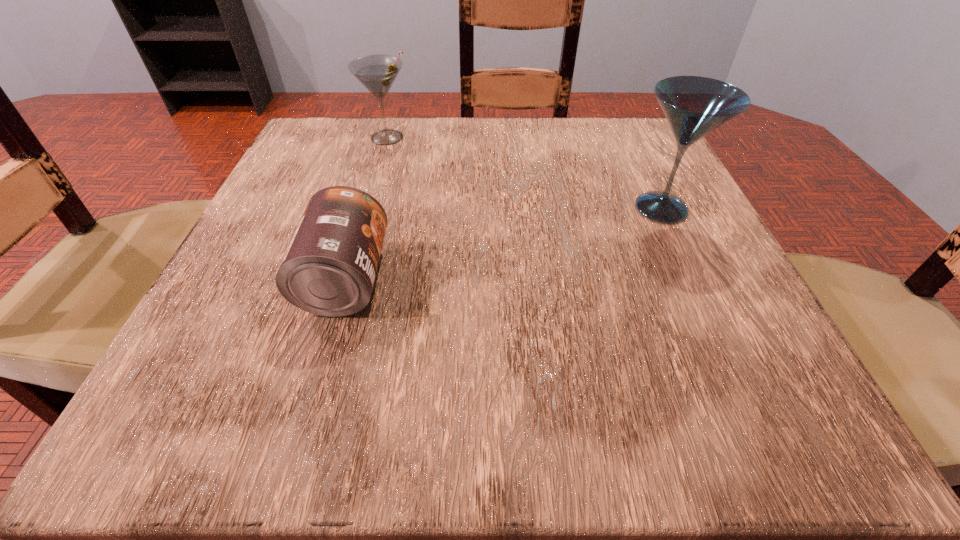
Locate an element on the screen. martini at the left edge is located at coordinates (377, 73).

This screenshot has width=960, height=540. What are the coordinates of `can that is at the left edge` in the screenshot? It's located at (329, 269).

The width and height of the screenshot is (960, 540). I want to click on object that is at the right edge, so click(694, 106).

Where is `object at the far left corner`? The height and width of the screenshot is (540, 960). object at the far left corner is located at coordinates (377, 73).

Identify the location of free location at the far edge of the desktop. The height and width of the screenshot is (540, 960). (515, 131).

In the image, there is a desktop. Where is `vacant space at the near edge`? The image size is (960, 540). vacant space at the near edge is located at coordinates (535, 413).

At what (x,y) coordinates should I click in order to perform the action: click on vacant space at the left edge of the desktop. Please return your answer as a coordinate pair (x, y). Image resolution: width=960 pixels, height=540 pixels. Looking at the image, I should click on (315, 190).

Locate an element on the screen. vacant space at the right edge of the desktop is located at coordinates (700, 291).

Where is `free location at the far left corner of the desktop`? free location at the far left corner of the desktop is located at coordinates (285, 172).

This screenshot has width=960, height=540. I want to click on free space at the near left corner, so click(235, 398).